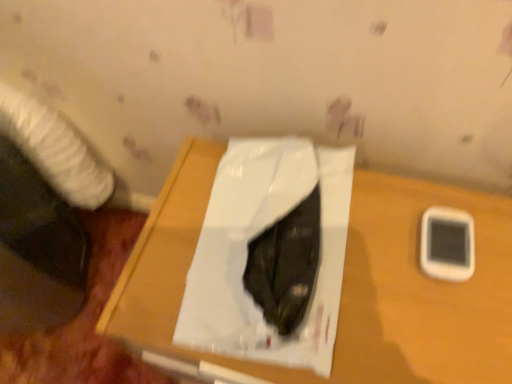
Identify the location of vacant space that's between white glossy paper at center and white plastic mobile phone at right. (384, 265).